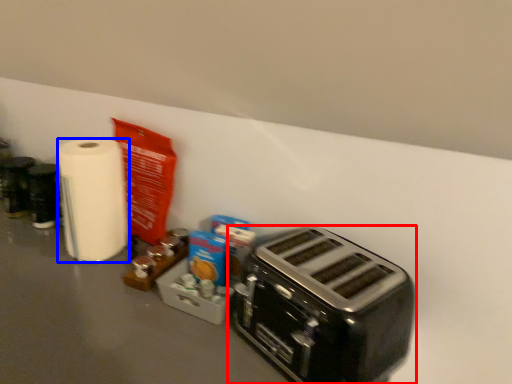
Question: Among these objects, which one is nearest to the camera, toaster (highlighted by a red box) or paper towel (highlighted by a blue box)?

Choices:
 (A) toaster
 (B) paper towel

Answer: (A)